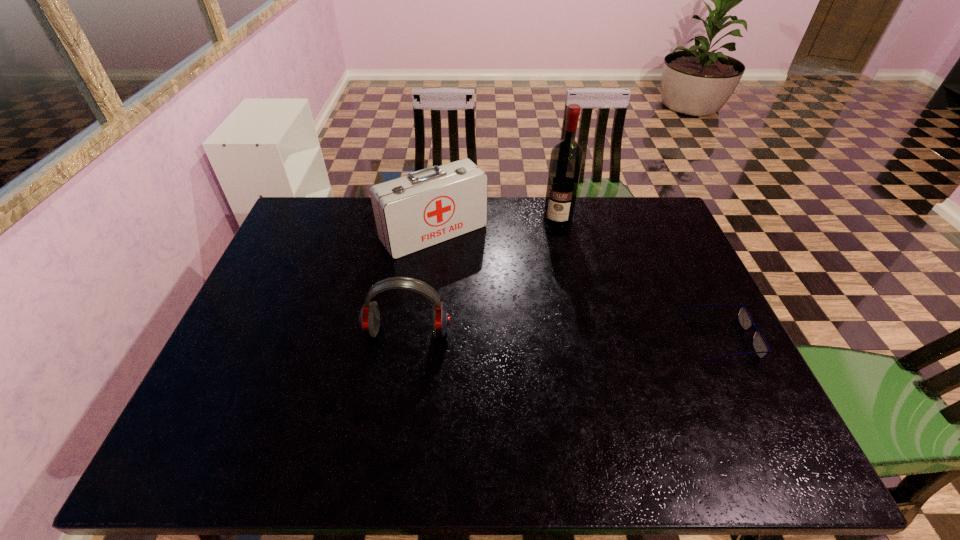
Where is `vacant space located on the front-facing side of the first-aid kit`? vacant space located on the front-facing side of the first-aid kit is located at coordinates (538, 347).

The height and width of the screenshot is (540, 960). In order to click on free space located on the front-facing side of the first-aid kit in this screenshot , I will do `click(516, 321)`.

In order to click on free region located on the front-facing side of the first-aid kit in this screenshot , I will do `click(470, 268)`.

This screenshot has width=960, height=540. Identify the location of alcohol situated at the far edge. (566, 158).

The image size is (960, 540). In order to click on the first-aid kit that is at the far edge in this screenshot , I will do `click(429, 206)`.

You are a GUI agent. You are given a task and a screenshot of the screen. Output one action in this format:
    pyautogui.click(x=<x>, y=<y>)
    Task: Click on the object at the right edge
    
    Given the screenshot: What is the action you would take?
    pyautogui.click(x=759, y=344)

In the image, there is a desktop. In order to click on vacant area at the far edge in this screenshot , I will do `click(491, 226)`.

Image resolution: width=960 pixels, height=540 pixels. Identify the location of blank space at the near edge of the desktop. (463, 400).

Identify the location of free space at the left edge of the desktop. (290, 343).

This screenshot has width=960, height=540. In the image, there is a desktop. Identify the location of vacant space at the right edge. (656, 318).